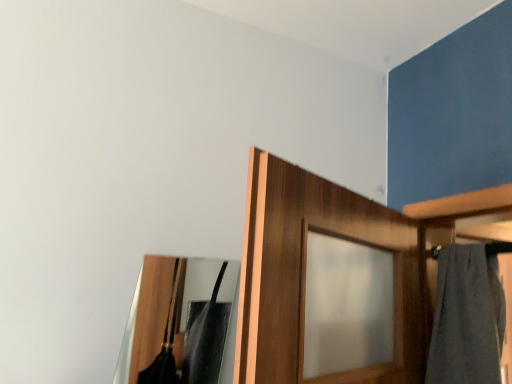
Measure the distance between clear glass mirror at center and camera.

clear glass mirror at center and camera are 3.74 feet apart from each other.

What is the approximate width of clear glass mirror at center?

clear glass mirror at center is 1.50 inches wide.

What do you see at coordinates (146, 318) in the screenshot? I see `clear glass mirror at center` at bounding box center [146, 318].

The height and width of the screenshot is (384, 512). Identify the location of clear glass mirror at center. (146, 318).

This screenshot has width=512, height=384. Describe the element at coordinates (467, 318) in the screenshot. I see `gray cotton bath towel at right` at that location.

Where is `gray cotton bath towel at right`? This screenshot has height=384, width=512. gray cotton bath towel at right is located at coordinates (467, 318).

Measure the distance between point (447, 365) and camera.

Point (447, 365) is 4.28 feet away from camera.

What is the approximate height of gray cotton bath towel at right?

gray cotton bath towel at right is 17.35 inches tall.

This screenshot has width=512, height=384. Identify the location of clear glass mirror at center. (146, 318).

Is gray cotton bath towel at right to the left of clear glass mirror at center from the viewer's perspective?

Incorrect, gray cotton bath towel at right is not on the left side of clear glass mirror at center.

Which object is further away from the camera, gray cotton bath towel at right or clear glass mirror at center?

gray cotton bath towel at right is more distant.

Which is closer, (x=450, y=307) or (x=149, y=350)?

Point (x=450, y=307) is positioned closer to the camera compared to point (x=149, y=350).

From the image's perspective, between gray cotton bath towel at right and clear glass mirror at center, which one is located above?

gray cotton bath towel at right appears higher in the image.

From a real-world perspective, is gray cotton bath towel at right over clear glass mirror at center?

Yes.

Does gray cotton bath towel at right have a lesser width compared to clear glass mirror at center?

Incorrect, the width of gray cotton bath towel at right is not less than that of clear glass mirror at center.

Can you confirm if gray cotton bath towel at right is shorter than clear glass mirror at center?

In fact, gray cotton bath towel at right may be taller than clear glass mirror at center.

Between gray cotton bath towel at right and clear glass mirror at center, which one has smaller size?

clear glass mirror at center is smaller.

Would you say gray cotton bath towel at right is outside clear glass mirror at center?

gray cotton bath towel at right is positioned outside clear glass mirror at center.

Does gray cotton bath towel at right touch clear glass mirror at center?

No, gray cotton bath towel at right is not beside clear glass mirror at center.

Is gray cotton bath towel at right aimed at clear glass mirror at center?

No, gray cotton bath towel at right is not oriented towards clear glass mirror at center.

Can you tell me how much gray cotton bath towel at right and clear glass mirror at center differ in facing direction?

There is a 88.7-degree angle between the facing directions of gray cotton bath towel at right and clear glass mirror at center.

How far apart are gray cotton bath towel at right and clear glass mirror at center?

gray cotton bath towel at right and clear glass mirror at center are 31.67 inches apart.

At what (x,y) coordinates should I click in order to perform the action: click on mirror that appears on the left of gray cotton bath towel at right. Please return your answer as a coordinate pair (x, y). Image resolution: width=512 pixels, height=384 pixels. Looking at the image, I should click on (146, 318).

Based on their positions, is clear glass mirror at center located to the left or right of gray cotton bath towel at right?

In the image, clear glass mirror at center appears on the left side of gray cotton bath towel at right.

Which object is closer to the camera taking this photo, clear glass mirror at center or gray cotton bath towel at right?

clear glass mirror at center is in front.

Is point (151, 336) closer to viewer compared to point (497, 289)?

No, (151, 336) is further to viewer.

From the image's perspective, is clear glass mirror at center above or below gray cotton bath towel at right?

clear glass mirror at center is below gray cotton bath towel at right.

From a real-world perspective, does clear glass mirror at center sit lower than gray cotton bath towel at right?

Correct, in the physical world, clear glass mirror at center is lower than gray cotton bath towel at right.

Is clear glass mirror at center wider than gray cotton bath towel at right?

No.

In terms of height, does clear glass mirror at center look taller or shorter compared to gray cotton bath towel at right?

Clearly, clear glass mirror at center is shorter compared to gray cotton bath towel at right.

Can you confirm if clear glass mirror at center is smaller than gray cotton bath towel at right?

Yes, clear glass mirror at center is smaller than gray cotton bath towel at right.

Is clear glass mirror at center completely or partially outside of gray cotton bath towel at right?

clear glass mirror at center is positioned outside gray cotton bath towel at right.

Are clear glass mirror at center and gray cotton bath towel at right beside each other?

No, clear glass mirror at center is not with gray cotton bath towel at right.

Could you tell me if clear glass mirror at center is facing gray cotton bath towel at right?

No, clear glass mirror at center is not oriented towards gray cotton bath towel at right.

How different are the orientations of clear glass mirror at center and gray cotton bath towel at right in degrees?

The angular difference between clear glass mirror at center and gray cotton bath towel at right is 88.7 degrees.

Find the location of a particular element. The height and width of the screenshot is (384, 512). bath towel lying on the right of clear glass mirror at center is located at coordinates (467, 318).

The width and height of the screenshot is (512, 384). Find the location of `bath towel located on the right of clear glass mirror at center`. bath towel located on the right of clear glass mirror at center is located at coordinates (467, 318).

The height and width of the screenshot is (384, 512). Identify the location of bath towel that is above the clear glass mirror at center (from the image's perspective). (467, 318).